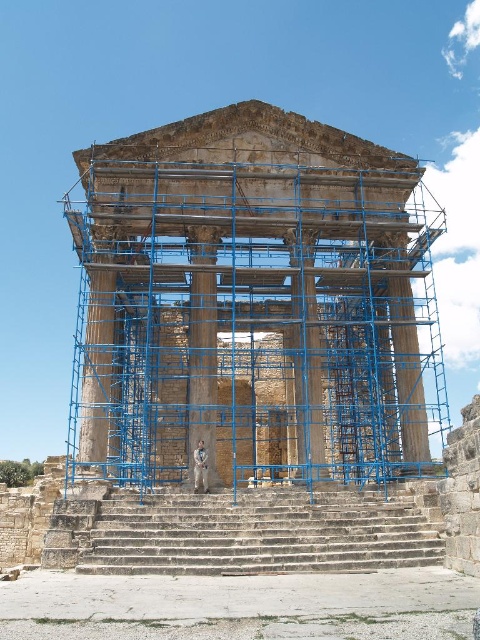
Consider the image. You are an architect examining the ancient stone structure. You notice the stone temple at center and the smooth stone pillar at center. Which object is positioned higher in the image?

The stone temple at center is positioned higher than the smooth stone pillar at center because it is located above it.

You are an archaeologist standing at the edge of the site. You need to locate the stone temple at center. Where should you look based on the coordinates provided?

The stone temple at center is located at the 2D coordinates point (x=252, y=305), so you should look towards the center of the image where those coordinates are marked.

You are a worker standing at point (x=195, y=262) and need to move to point (x=251, y=426). Given that the scaffolding is 1.5 meters wide, can you walk directly to your destination without detouring around the structure?

Point (x=251, y=426) is behind point (x=195, y=262), so you cannot walk directly to it without going around the structure since it is not in front of your current position.